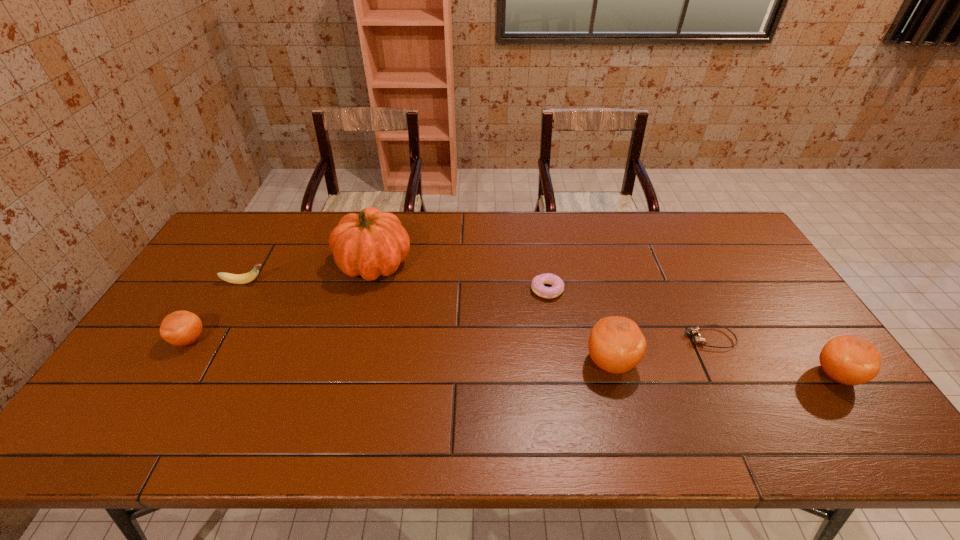
Where is `free spot between the third object from left to right and the doughnut`? This screenshot has height=540, width=960. free spot between the third object from left to right and the doughnut is located at coordinates (461, 276).

You are a GUI agent. You are given a task and a screenshot of the screen. Output one action in this format:
    pyautogui.click(x=<x>, y=<y>)
    Task: Click on the object that can be found as the second closest to the leftmost orange
    This screenshot has width=960, height=540.
    Given the screenshot: What is the action you would take?
    pyautogui.click(x=372, y=243)

At what (x,y) coordinates should I click in order to perform the action: click on object that is the fifth nearest to the shortest orange. Please return your answer as a coordinate pair (x, y). The width and height of the screenshot is (960, 540). Looking at the image, I should click on (699, 339).

Where is `orange that is the closest one to the fourth tallest object`? The image size is (960, 540). orange that is the closest one to the fourth tallest object is located at coordinates (616, 344).

Locate an element on the screen. The width and height of the screenshot is (960, 540). orange that stands as the closest to the leftmost orange is located at coordinates (616, 344).

Locate an element on the screen. Image resolution: width=960 pixels, height=540 pixels. free space that satisfies the following two spatial constraints: 1. on the front side of the second tallest object; 2. on the right side of the fifth object from right to left is located at coordinates (348, 363).

Identify the location of blank space that satisfies the following two spatial constraints: 1. on the front lenses and sides of the second object from right to left; 2. on the left side of the fifth shortest object. This screenshot has height=540, width=960. (728, 375).

Identify the location of vacant space that satisfies the following two spatial constraints: 1. on the back side of the fourth tallest object; 2. on the left side of the pumpkin. [236, 264].

Where is `blank space that satisfies the following two spatial constraints: 1. at the stem of the second tallest object; 2. on the right side of the third shortest object`? blank space that satisfies the following two spatial constraints: 1. at the stem of the second tallest object; 2. on the right side of the third shortest object is located at coordinates (200, 363).

Locate an element on the screen. The width and height of the screenshot is (960, 540). vacant space that satisfies the following two spatial constraints: 1. on the front lenses and sides of the second object from right to left; 2. on the right side of the fifth shortest object is located at coordinates (728, 375).